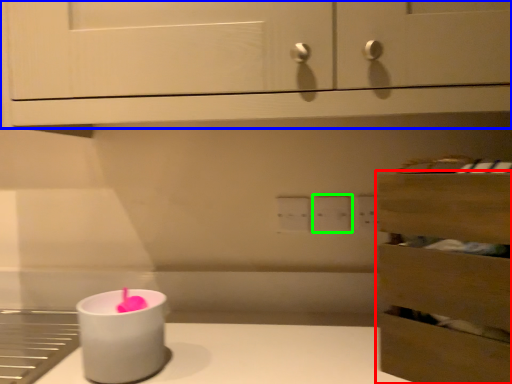
Question: Which object is the farthest from drawer (highlighted by a red box)? Choose among these: cabinetry (highlighted by a blue box) or electric outlet (highlighted by a green box).

Choices:
 (A) cabinetry
 (B) electric outlet

Answer: (B)